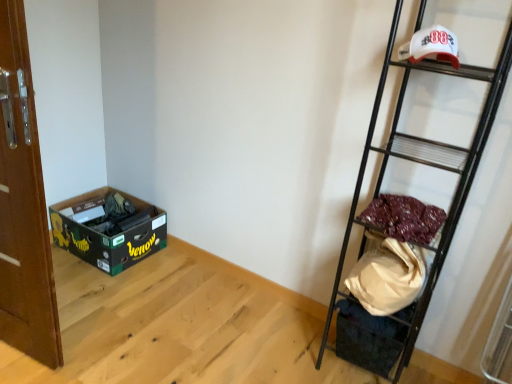
Find the location of a particular element. This screenshot has width=512, height=384. vacant space to the left of black metal ladder at right is located at coordinates (287, 347).